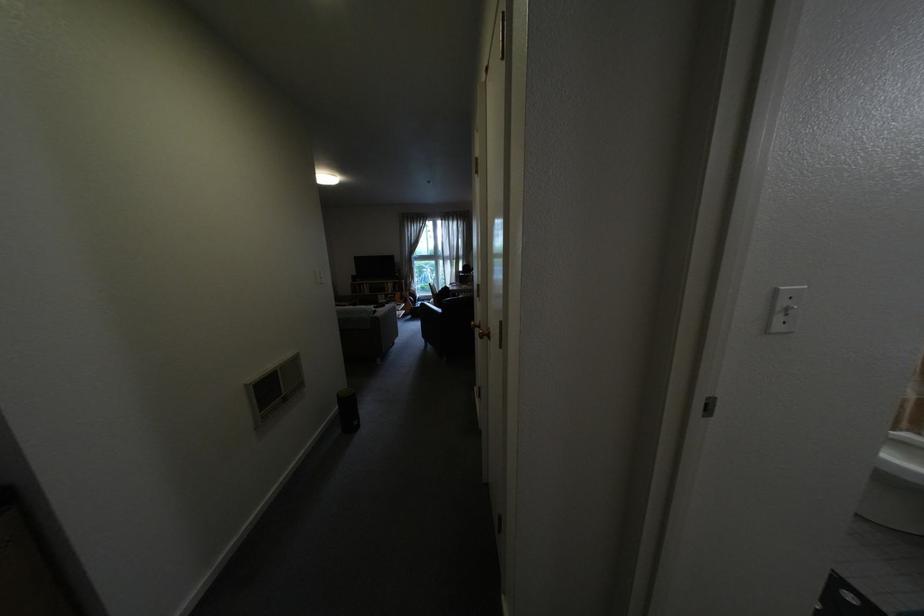
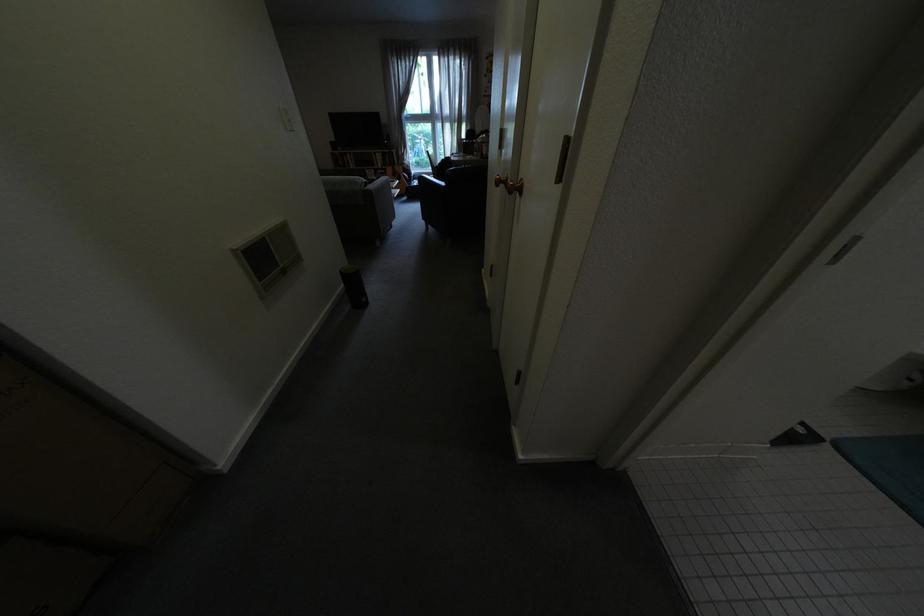
Question: The images are taken continuously from a first-person perspective. In which direction is your viewpoint rotating?

Choices:
 (A) Left
 (B) Right
 (C) Up
 (D) Down

Answer: (D)